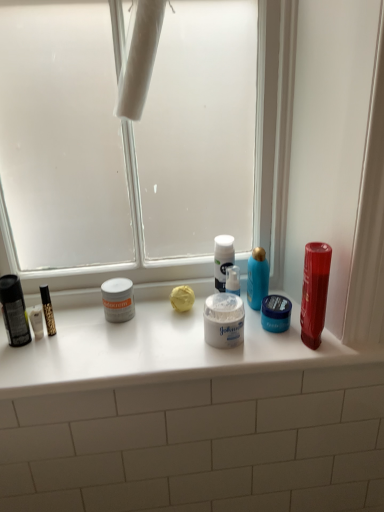
This screenshot has height=512, width=384. Describe the element at coordinates (157, 351) in the screenshot. I see `white matte counter at center` at that location.

Locate an element on the screen. blue matte jar at center, which is the first toiletry in right-to-left order is located at coordinates (276, 313).

Where is `white matte jar at center`? Image resolution: width=384 pixels, height=512 pixels. white matte jar at center is located at coordinates (224, 320).

The width and height of the screenshot is (384, 512). Identify the location of transparent glass window screen at center. (129, 143).

I want to click on blue glossy bottle at center, so click(x=257, y=278).

What do you see at coordinates (257, 278) in the screenshot? I see `blue glossy bottle at center` at bounding box center [257, 278].

Where is `white matte counter at center`? The image size is (384, 512). white matte counter at center is located at coordinates (157, 351).

Who is taller, shiny plastic mouthwash at right or white matte counter at center?

shiny plastic mouthwash at right.

Is shiny plastic mouthwash at right positioned far away from white matte counter at center?

They are positioned close to each other.

Considering the points (316, 298) and (66, 343), which point is behind, point (316, 298) or point (66, 343)?

The point (66, 343) is farther from the camera.

Can you tell me how much white matte counter at center and shiny plastic mouthwash at right differ in facing direction?

The angle between the facing direction of white matte counter at center and the facing direction of shiny plastic mouthwash at right is 0.291 degrees.

From a real-world perspective, is white matte counter at center over shiny plastic mouthwash at right?

No, from a real-world perspective, white matte counter at center is not over shiny plastic mouthwash at right

Considering the sizes of white matte counter at center and shiny plastic mouthwash at right in the image, is white matte counter at center bigger or smaller than shiny plastic mouthwash at right?

Considering their sizes, white matte counter at center takes up more space than shiny plastic mouthwash at right.

Is white matte counter at center oriented away from shiny plastic mouthwash at right?

white matte counter at center is not turned away from shiny plastic mouthwash at right.

How different are the orientations of shiny plastic mouthwash at right and white matte jar at center, positioned as the second toiletry in right-to-left order, in degrees?

7.52e-05 degrees.

Could you tell me if shiny plastic mouthwash at right is turned towards white matte jar at center, marked as the 1th toiletry in a left-to-right arrangement?

No, shiny plastic mouthwash at right does not turn towards white matte jar at center, marked as the 1th toiletry in a left-to-right arrangement.

Is shiny plastic mouthwash at right to the left or to the right of white matte jar at center, marked as the 1th toiletry in a left-to-right arrangement, in the image?

shiny plastic mouthwash at right is to the right of white matte jar at center, marked as the 1th toiletry in a left-to-right arrangement.

From the image's perspective, relative to white matte jar at center, marked as the 1th toiletry in a left-to-right arrangement, is shiny plastic mouthwash at right above or below?

Based on their image positions, shiny plastic mouthwash at right is located above white matte jar at center, marked as the 1th toiletry in a left-to-right arrangement.

From the image's perspective, is shiny plastic mouthwash at right on top of transparent glass window screen at center?

No.

Between shiny plastic mouthwash at right and transparent glass window screen at center, which one is positioned behind?

transparent glass window screen at center is further away from the camera.

Which is more to the left, shiny plastic mouthwash at right or transparent glass window screen at center?

Positioned to the left is transparent glass window screen at center.

Considering the relative sizes of blue glossy bottle at center and white matte counter at center in the image provided, is blue glossy bottle at center taller than white matte counter at center?

Indeed, blue glossy bottle at center has a greater height compared to white matte counter at center.

You are a GUI agent. You are given a task and a screenshot of the screen. Output one action in this format:
    pyautogui.click(x=<x>, y=<y>)
    Task: Click on the cleaning product on the right of white matte counter at center
    The image size is (384, 512).
    Given the screenshot: What is the action you would take?
    pyautogui.click(x=257, y=278)

Is blue glossy bottle at center situated inside white matte counter at center or outside?

blue glossy bottle at center is located beyond the bounds of white matte counter at center.

Between blue glossy bottle at center and white matte counter at center, which one appears on the left side from the viewer's perspective?

white matte counter at center is more to the left.

Considering the sizes of objects transparent glass window screen at center and shiny plastic mouthwash at right in the image provided, who is taller, transparent glass window screen at center or shiny plastic mouthwash at right?

Standing taller between the two is transparent glass window screen at center.

You are a GUI agent. You are given a task and a screenshot of the screen. Output one action in this format:
    pyautogui.click(x=<x>, y=<y>)
    Task: Click on the window screen above the shiny plastic mouthwash at right (from the image's perspective)
    This screenshot has height=512, width=384.
    Given the screenshot: What is the action you would take?
    pyautogui.click(x=129, y=143)

Is transparent glass window screen at center touching shiny plastic mouthwash at right?

No, transparent glass window screen at center is not in contact with shiny plastic mouthwash at right.

Based on the photo, considering the relative positions of white matte jar at center, marked as the 1th toiletry in a left-to-right arrangement, and white matte jar at center in the image provided, is white matte jar at center, marked as the 1th toiletry in a left-to-right arrangement, to the right of white matte jar at center from the viewer's perspective?

No.

Is white matte jar at center, marked as the 1th toiletry in a left-to-right arrangement, positioned behind white matte jar at center?

Yes, it is.

Is white matte jar at center, marked as the 1th toiletry in a left-to-right arrangement, spatially inside white matte jar at center, or outside of it?

white matte jar at center, marked as the 1th toiletry in a left-to-right arrangement, is not inside white matte jar at center, it's outside.

Is white matte jar at center, marked as the 1th toiletry in a left-to-right arrangement, oriented away from white matte jar at center?

No, white matte jar at center, marked as the 1th toiletry in a left-to-right arrangement,'s orientation is not away from white matte jar at center.

The width and height of the screenshot is (384, 512). In order to click on counter below the shiny plastic mouthwash at right (from a real-world perspective) in this screenshot , I will do `click(157, 351)`.

Identify the location of counter below the shiny plastic mouthwash at right (from the image's perspective). (157, 351).

Estimate the real-world distances between objects in this image. Which object is closer to white matte jar at center, marked as the 1th toiletry in a left-to-right arrangement, white matte counter at center or white matte jar at center?

Based on the image, white matte counter at center appears to be nearer to white matte jar at center, marked as the 1th toiletry in a left-to-right arrangement.

From the image, which object appears to be farther from white matte counter at center, transparent glass window screen at center or blue glossy bottle at center?

Among the two, transparent glass window screen at center is located further to white matte counter at center.

Looking at the image, which one is located closer to white matte counter at center, white matte jar at center or white matte jar at center, positioned as the second toiletry in right-to-left order?

Among the two, white matte jar at center is located nearer to white matte counter at center.

When comparing their distances from blue matte jar at center, the 2th toiletry viewed from the left, does shiny plastic mouthwash at right or blue glossy bottle at center seem further?

shiny plastic mouthwash at right.

Estimate the real-world distances between objects in this image. Which object is further from transparent glass window screen at center, white matte counter at center or shiny plastic mouthwash at right?

shiny plastic mouthwash at right lies further to transparent glass window screen at center than the other object.

Which object lies nearer to the anchor point white matte jar at center, white matte counter at center or shiny plastic mouthwash at right?

Based on the image, white matte counter at center appears to be nearer to white matte jar at center.

When comparing their distances from transparent glass window screen at center, does blue matte jar at center, the 2th toiletry viewed from the left, or blue glossy bottle at center seem further?

blue matte jar at center, the 2th toiletry viewed from the left, is further to transparent glass window screen at center.

Looking at the image, which one is located further to white matte jar at center, transparent glass window screen at center or white matte jar at center, marked as the 1th toiletry in a left-to-right arrangement?

transparent glass window screen at center.

You are a GUI agent. You are given a task and a screenshot of the screen. Output one action in this format:
    pyautogui.click(x=<x>, y=<y>)
    Task: Click on the cream located between white matte jar at center, marked as the 1th toiletry in a left-to-right arrangement, and blue glossy bottle at center in the left-right direction
    
    Given the screenshot: What is the action you would take?
    point(224,320)

Locate an element on the screen. counter between white matte jar at center, positioned as the second toiletry in right-to-left order, and blue matte jar at center, the 2th toiletry viewed from the left, in the horizontal direction is located at coordinates (157, 351).

Identify the location of cleaning product situated between transparent glass window screen at center and shiny plastic mouthwash at right from left to right. coord(257,278).

Image resolution: width=384 pixels, height=512 pixels. In order to click on cleaning product situated between white matte jar at center, marked as the 1th toiletry in a left-to-right arrangement, and blue matte jar at center, the 2th toiletry viewed from the left, from left to right in this screenshot , I will do `click(257, 278)`.